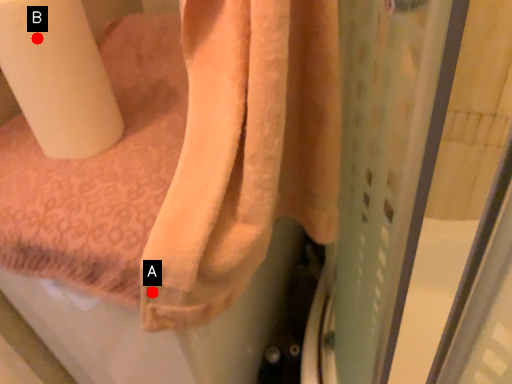
Question: Two points are circled on the image, labeled by A and B beside each circle. Which point is closer to the camera taking this photo?

Choices:
 (A) A is closer
 (B) B is closer

Answer: (B)